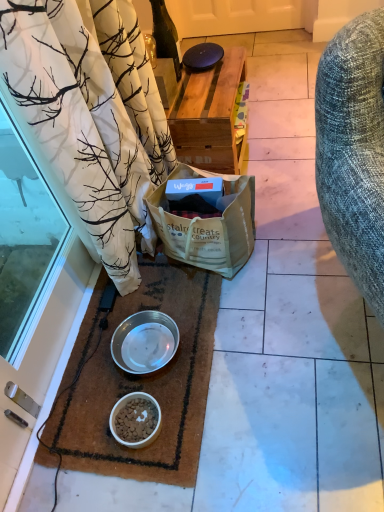
Question: Is black glossy tile at center thinner than white matte bowl at lower center, placed as the first bowl when sorted from bottom to top?

Choices:
 (A) yes
 (B) no

Answer: (B)

Question: Are black glossy tile at center and white matte bowl at lower center, which is the 2th bowl from top to bottom, making contact?

Choices:
 (A) no
 (B) yes

Answer: (A)

Question: Considering the relative sizes of black glossy tile at center and white matte bowl at lower center, which is the 2th bowl from top to bottom, in the image provided, is black glossy tile at center smaller than white matte bowl at lower center, which is the 2th bowl from top to bottom,?

Choices:
 (A) yes
 (B) no

Answer: (B)

Question: Is black glossy tile at center positioned in front of white matte bowl at lower center, placed as the first bowl when sorted from bottom to top?

Choices:
 (A) no
 (B) yes

Answer: (A)

Question: Is black glossy tile at center at the right side of white matte bowl at lower center, which is the 2th bowl from top to bottom?

Choices:
 (A) yes
 (B) no

Answer: (A)

Question: Is brown woven mat at lower left situated inside green glass bottle at upper center or outside?

Choices:
 (A) inside
 (B) outside

Answer: (B)

Question: From the image's perspective, relative to green glass bottle at upper center, is brown woven mat at lower left above or below?

Choices:
 (A) above
 (B) below

Answer: (B)

Question: Visually, is brown woven mat at lower left positioned to the left or to the right of green glass bottle at upper center?

Choices:
 (A) right
 (B) left

Answer: (B)

Question: In the image, is brown woven mat at lower left positioned in front of or behind green glass bottle at upper center?

Choices:
 (A) behind
 (B) front

Answer: (B)

Question: Considering the positions of black glossy tile at center and brown woven mat at lower left in the image, is black glossy tile at center taller or shorter than brown woven mat at lower left?

Choices:
 (A) tall
 (B) short

Answer: (B)

Question: From a real-world perspective, relative to brown woven mat at lower left, is black glossy tile at center vertically above or below?

Choices:
 (A) below
 (B) above

Answer: (A)

Question: In terms of size, does black glossy tile at center appear bigger or smaller than brown woven mat at lower left?

Choices:
 (A) big
 (B) small

Answer: (B)

Question: In terms of width, does black glossy tile at center look wider or thinner when compared to brown woven mat at lower left?

Choices:
 (A) thin
 (B) wide

Answer: (A)

Question: From the image's perspective, is green glass bottle at upper center positioned above or below metallic silver bowl at lower center, arranged as the first bowl when viewed from the top?

Choices:
 (A) above
 (B) below

Answer: (A)

Question: Which is correct: green glass bottle at upper center is inside metallic silver bowl at lower center, acting as the 2th bowl starting from the bottom, or outside of it?

Choices:
 (A) inside
 (B) outside

Answer: (B)